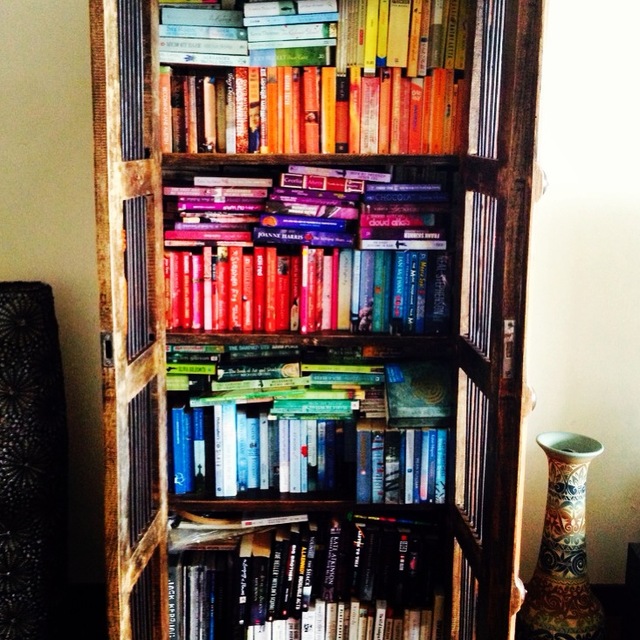
This screenshot has height=640, width=640. Identify the location of wall. (45, 182), (594, 175).